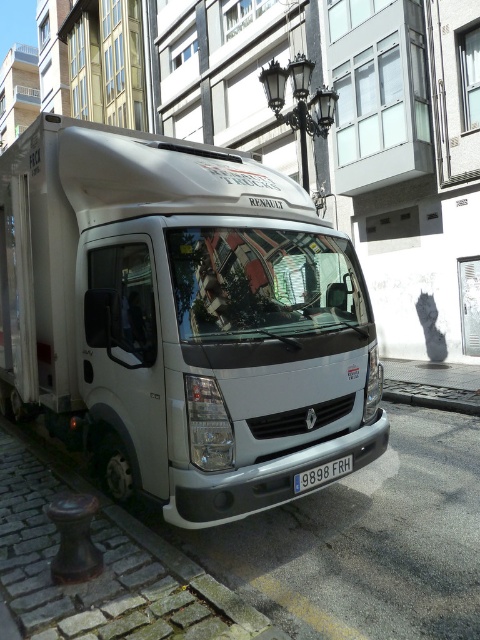
Is the position of white matte truck at center more distant than that of brown concrete curb at lower left?

Yes, it is behind brown concrete curb at lower left.

Between white matte truck at center and brown concrete curb at lower left, which one has more height?

With more height is white matte truck at center.

The height and width of the screenshot is (640, 480). I want to click on white matte truck at center, so click(181, 317).

Is brown concrete curb at lower left to the left of white plastic license plate at center from the viewer's perspective?

Correct, you'll find brown concrete curb at lower left to the left of white plastic license plate at center.

Between brown concrete curb at lower left and white plastic license plate at center, which one has more height?

Standing taller between the two is white plastic license plate at center.

Does point (8, 484) come in front of point (321, 477)?

No, it is behind (321, 477).

I want to click on brown concrete curb at lower left, so click(105, 570).

Between point (156, 252) and point (337, 461), which one is positioned in front?

Positioned in front is point (156, 252).

Is point (127, 275) positioned in front of point (319, 467)?

No, it is not.

Which is behind, point (60, 320) or point (328, 476)?

The point (60, 320) is more distant.

I want to click on white matte truck at center, so click(x=181, y=317).